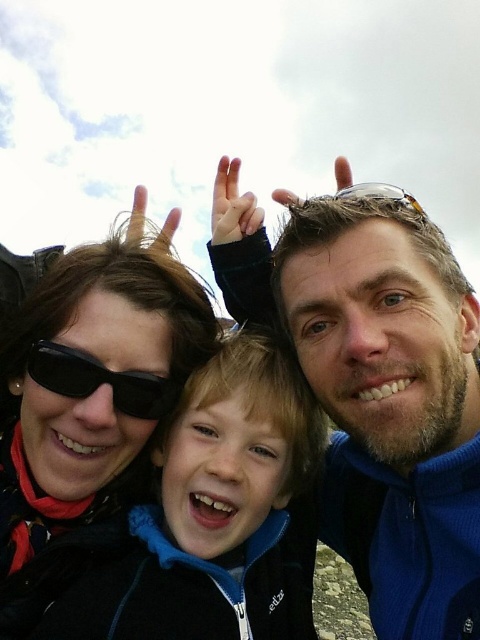
Based on the photo, in the family photo, where is the black fleece jacket at center in relation to the black matte sunglasses at upper left?

The black fleece jacket at center is to the right of the black matte sunglasses at upper left.

You are a photographer trying to capture the scene. You notice a black matte sunglasses at upper left located at point [87,403]. The photographer wants to ensure that the sunglasses are not blocking the view of the child making the playful gesture. Is the black matte sunglasses at upper left positioned in a way that it might obstruct the child?

The black matte sunglasses at upper left is located at point [87,403]. Since the sunglasses are at the upper left, they are positioned away from the center where the child is making the playful gesture, so they are not obstructing the child.